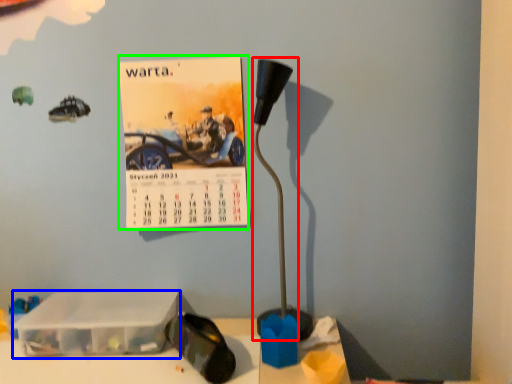
Question: Which is farther away from lamp (highlighted by a red box)? box (highlighted by a blue box) or postcard (highlighted by a green box)?

Choices:
 (A) box
 (B) postcard

Answer: (A)